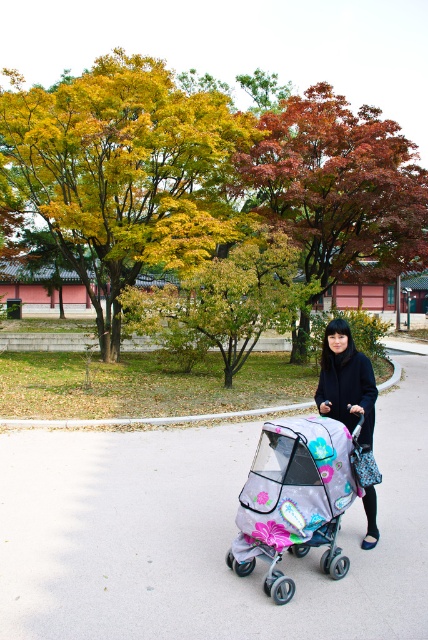
Question: Is gray asphalt pavement at center closer to the viewer compared to floral-patterned fabric stroller at center?

Choices:
 (A) no
 (B) yes

Answer: (A)

Question: Is gray asphalt pavement at center positioned before black matte coat at center?

Choices:
 (A) no
 (B) yes

Answer: (A)

Question: Which object is positioned farthest from the autumn leaves at upper center?

Choices:
 (A) gray asphalt pavement at center
 (B) floral-patterned fabric stroller at center
 (C) black matte coat at center

Answer: (A)

Question: Estimate the real-world distances between objects in this image. Which object is farther from the autumn leaves at upper center?

Choices:
 (A) floral-patterned fabric stroller at center
 (B) black matte coat at center

Answer: (B)

Question: Is floral-patterned fabric stroller at center wider than black matte coat at center?

Choices:
 (A) no
 (B) yes

Answer: (B)

Question: Estimate the real-world distances between objects in this image. Which object is farther from the gray asphalt pavement at center?

Choices:
 (A) autumn leaves at upper center
 (B) black matte coat at center
 (C) floral-patterned fabric stroller at center

Answer: (A)